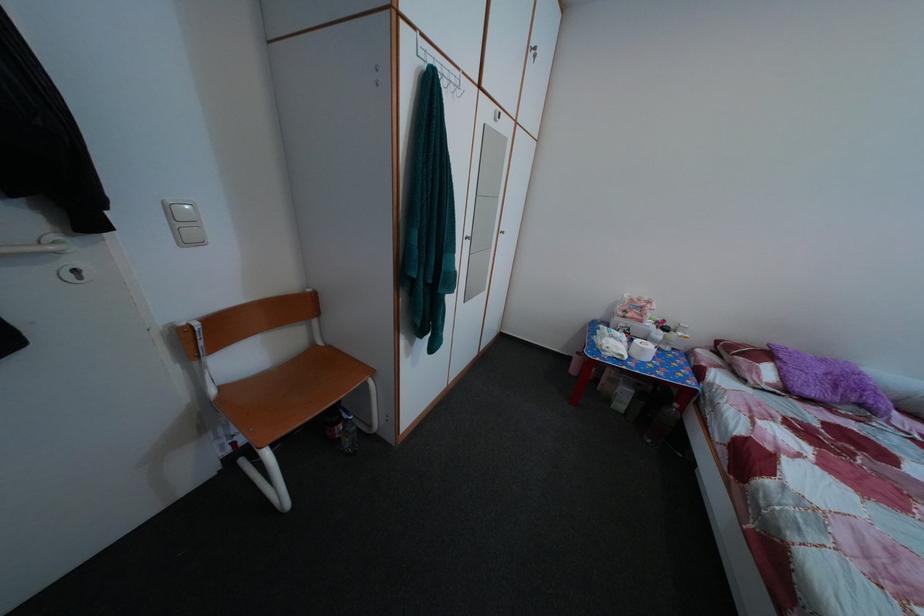
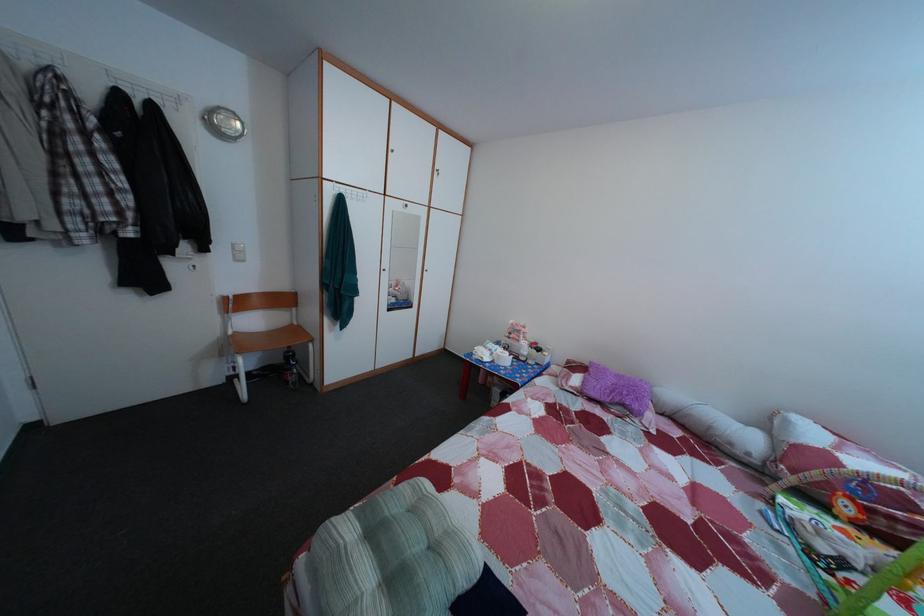
Find the pixel in the second image that matches [229,395] in the first image.

(245, 339)